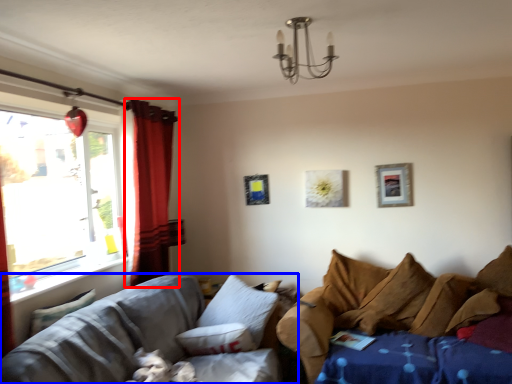
Question: Which point is further to the camera, curtain (highlighted by a red box) or studio couch (highlighted by a blue box)?

Choices:
 (A) curtain
 (B) studio couch

Answer: (A)